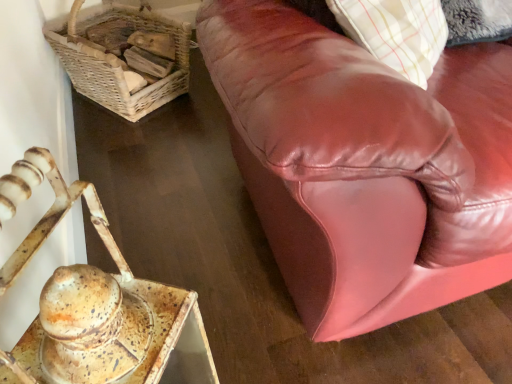
Where is `free space above shiny brown leather couch at upper right (from a real-world perspective)`? free space above shiny brown leather couch at upper right (from a real-world perspective) is located at coordinates (194, 184).